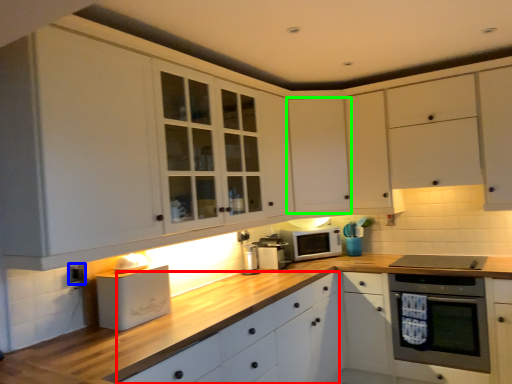
Question: Estimate the real-world distances between objects in this image. Which object is closer to drawer (highlighted by a red box), electric outlet (highlighted by a blue box) or cabinetry (highlighted by a green box)?

Choices:
 (A) electric outlet
 (B) cabinetry

Answer: (B)